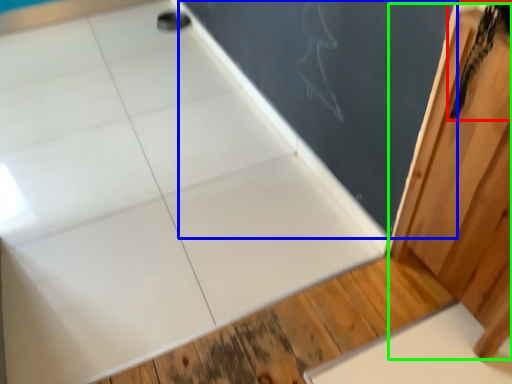
Question: Which is nearer to the animal (highlighted by a red box)? bulletin board (highlighted by a blue box) or barn door (highlighted by a green box).

Choices:
 (A) bulletin board
 (B) barn door

Answer: (B)